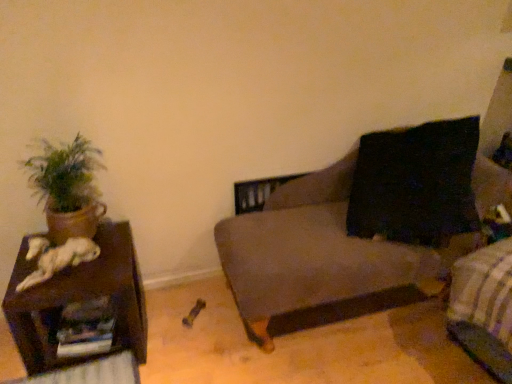
Where is `free point below dark gray fabric couch at center (from a real-world perspective)`? This screenshot has height=384, width=512. free point below dark gray fabric couch at center (from a real-world perspective) is located at coordinates (348, 316).